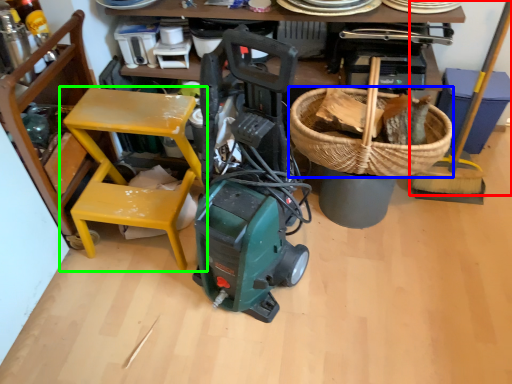
Question: Which is farther away from shovel (highlighted by a red box)? basket (highlighted by a blue box) or chair (highlighted by a green box)?

Choices:
 (A) basket
 (B) chair

Answer: (B)